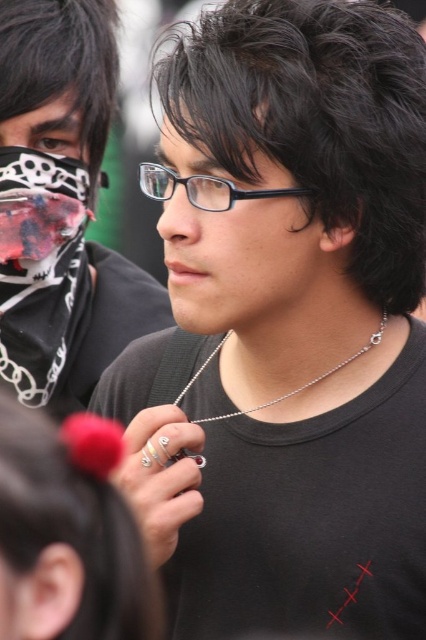
Question: Which point is farther to the camera?

Choices:
 (A) (253, 6)
 (B) (181, 396)
 (C) (40, 148)
 (D) (13, 547)

Answer: (C)

Question: Does dark brown silky hair at lower left appear on the left side of matte black mask at upper left?

Choices:
 (A) yes
 (B) no

Answer: (B)

Question: Estimate the real-world distances between objects in this image. Which object is farther from the silver chain necklace at center?

Choices:
 (A) black matte hair at center
 (B) matte black glasses at center
 (C) matte black shirt at center
 (D) matte black mask at upper left

Answer: (D)

Question: Which is farther from the dark brown silky hair at lower left?

Choices:
 (A) matte black mask at upper left
 (B) matte black shirt at center
 (C) silver chain necklace at center
 (D) black matte hair at center

Answer: (A)

Question: Is matte black glasses at center to the right of matte black mask at upper left from the viewer's perspective?

Choices:
 (A) yes
 (B) no

Answer: (A)

Question: Can you confirm if dark brown silky hair at lower left is bigger than matte black glasses at center?

Choices:
 (A) no
 (B) yes

Answer: (A)